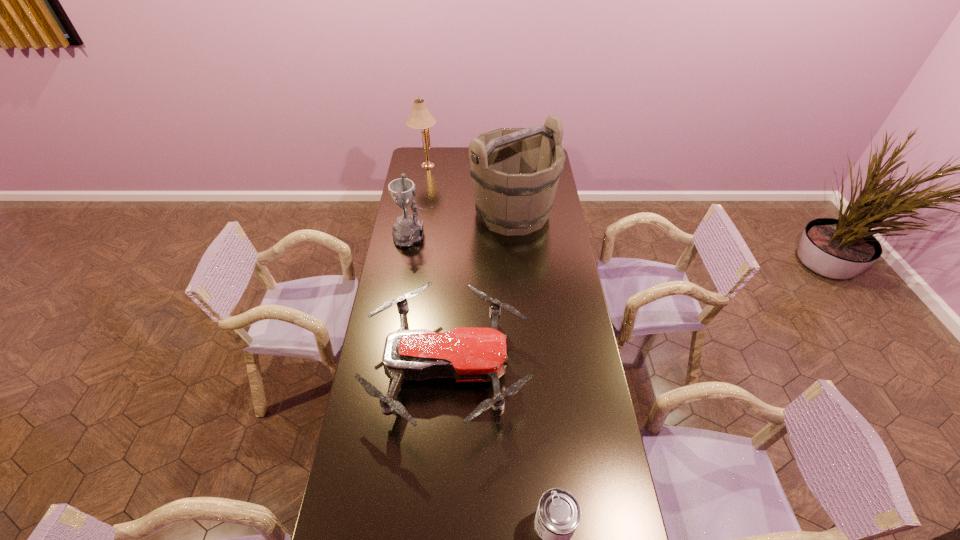
Select which object is the third closest to the drone. Please provide its 2D coordinates. Your answer should be formatted as a tuple, i.e. [(x, y)], where the tuple contains the x and y coordinates of a point satisfying the conditions above.

[(515, 172)]

This screenshot has height=540, width=960. In order to click on the second closest object to the fourth farthest object in this screenshot , I will do `click(408, 230)`.